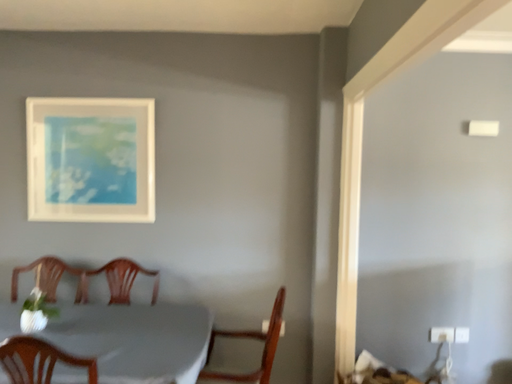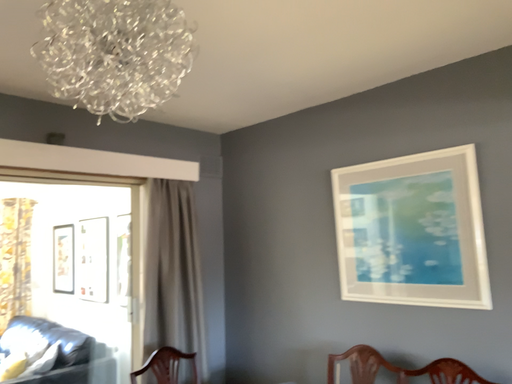
Question: Which way did the camera rotate in the video?

Choices:
 (A) rotated right
 (B) rotated left

Answer: (B)